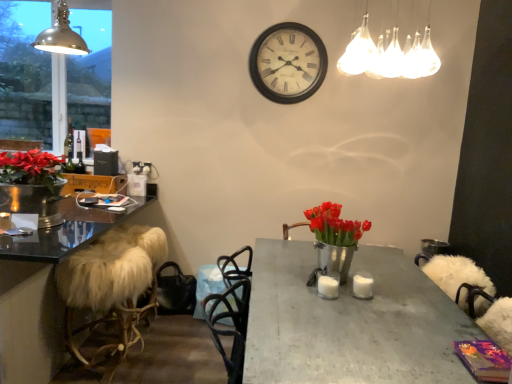
This screenshot has width=512, height=384. Identify the location of free point in front of white matte candle at table center, which appears as the second candle when viewed from the left. (367, 301).